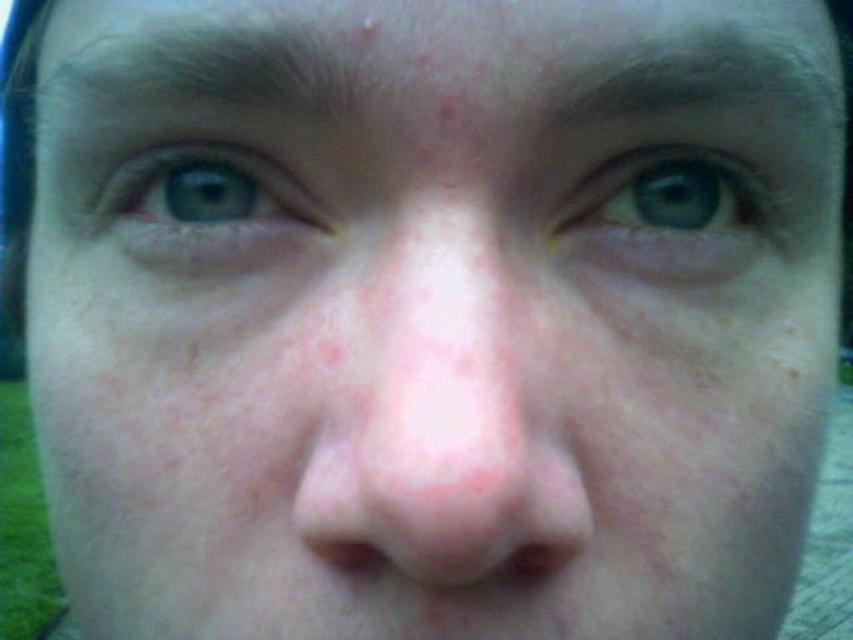
Is blue matte eye at upper center above pink flesh-colored nose at center?

Indeed, blue matte eye at upper center is positioned over pink flesh-colored nose at center.

Is point (723, 236) positioned after point (549, 534)?

Yes.

Where is `blue matte eye at upper center`? blue matte eye at upper center is located at coordinates (668, 216).

Who is shorter, green matte eye at upper left or pink flesh-colored nose at center?

pink flesh-colored nose at center is shorter.

Who is taller, green matte eye at upper left or pink flesh-colored nose at center?

green matte eye at upper left

Describe the element at coordinates (206, 209) in the screenshot. I see `green matte eye at upper left` at that location.

Where is `green matte eye at upper left`? The width and height of the screenshot is (853, 640). green matte eye at upper left is located at coordinates (206, 209).

Is green matte eye at upper left thinner than dark brown hair at upper center?

Indeed, green matte eye at upper left has a lesser width compared to dark brown hair at upper center.

Can you confirm if green matte eye at upper left is shorter than dark brown hair at upper center?

Correct, green matte eye at upper left is not as tall as dark brown hair at upper center.

Find the location of a particular element. The height and width of the screenshot is (640, 853). green matte eye at upper left is located at coordinates (206, 209).